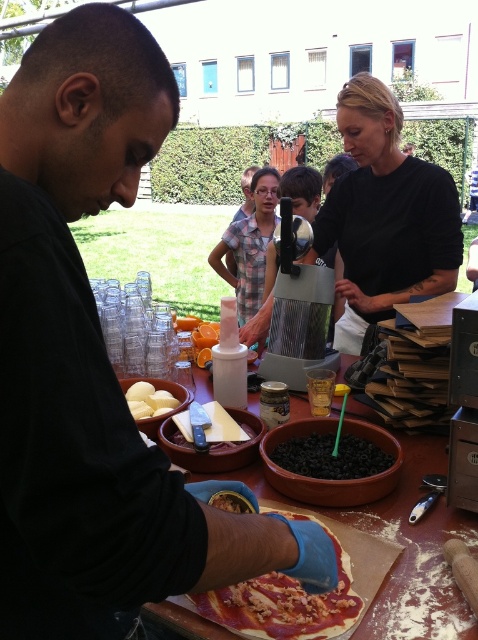
Between brown clay table at center and sharp metallic knife at center, which one appears on the right side from the viewer's perspective?

From the viewer's perspective, brown clay table at center appears more on the right side.

Who is lower down, brown clay table at center or sharp metallic knife at center?

brown clay table at center is below.

You are a GUI agent. You are given a task and a screenshot of the screen. Output one action in this format:
    pyautogui.click(x=<x>, y=<y>)
    Task: Click on the brown clay table at center
    The width and height of the screenshot is (478, 640).
    Given the screenshot: What is the action you would take?
    pyautogui.click(x=401, y=545)

Is blue latex glove at lower center positioned before white matte potato at center?

Yes, it is in front of white matte potato at center.

This screenshot has height=640, width=478. What are the coordinates of `blue latex glove at lower center` in the screenshot? It's located at (96, 364).

Which is behind, point (85, 291) or point (156, 392)?

Point (156, 392)

I want to click on blue latex glove at lower center, so click(x=96, y=364).

Does thick dough pizza at center appear over black matte beans at center?

Incorrect, thick dough pizza at center is not positioned above black matte beans at center.

Does point (283, 627) come farther from viewer compared to point (279, 465)?

No.

Is point (263, 582) more distant than point (324, 442)?

No, (263, 582) is closer to viewer.

You are a GUI agent. You are given a task and a screenshot of the screen. Output one action in this format:
    pyautogui.click(x=<x>, y=<y>)
    Task: Click on the thick dough pizza at center
    The image size is (478, 640).
    Given the screenshot: What is the action you would take?
    pyautogui.click(x=283, y=604)